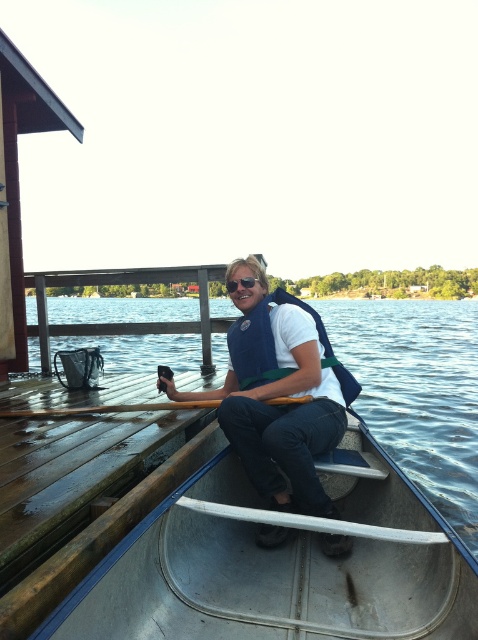
Between point (441, 417) and point (175, 401), which one is positioned in front?

Point (175, 401) is more forward.

Locate an element on the screen. clear water at boat center is located at coordinates (417, 392).

The image size is (478, 640). In order to click on clear water at boat center in this screenshot , I will do `click(417, 392)`.

How far apart are clear water at boat center and navy blue fabric life jacket at center?

clear water at boat center and navy blue fabric life jacket at center are 14.49 meters apart from each other.

Which is more to the right, clear water at boat center or navy blue fabric life jacket at center?

Positioned to the right is clear water at boat center.

Where is `clear water at boat center`? This screenshot has width=478, height=640. clear water at boat center is located at coordinates (417, 392).

How far apart are white matte life vest at center and sunglasses at center?

The distance of white matte life vest at center from sunglasses at center is 26.31 inches.

Between point (315, 483) and point (243, 284), which one is positioned in front?

Point (315, 483)

Is point (291, 500) more distant than point (232, 289)?

No, (291, 500) is in front of (232, 289).

Where is `white matte life vest at center`? white matte life vest at center is located at coordinates (278, 394).